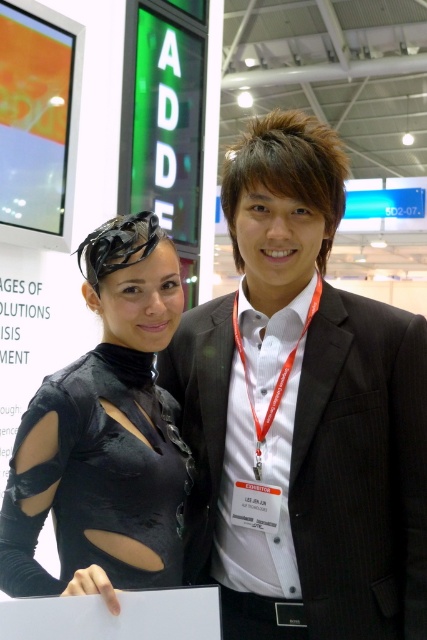
Does black pinstripe suit at center have a greater height compared to matte black dress at center?

Indeed, black pinstripe suit at center has a greater height compared to matte black dress at center.

Between black pinstripe suit at center and matte black dress at center, which one has less height?

Standing shorter between the two is matte black dress at center.

Describe the element at coordinates (301, 413) in the screenshot. This screenshot has height=640, width=427. I see `black pinstripe suit at center` at that location.

I want to click on black pinstripe suit at center, so click(x=301, y=413).